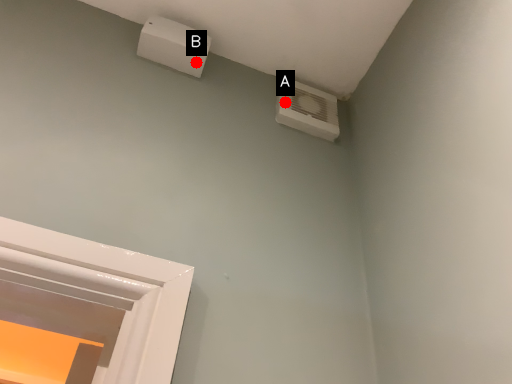
Question: Two points are circled on the image, labeled by A and B beside each circle. Which point appears closest to the camera in this image?

Choices:
 (A) A is closer
 (B) B is closer

Answer: (B)